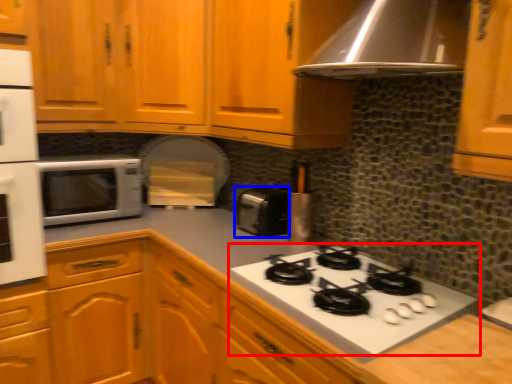
Question: Which object is further to the camera taking this photo, gas stove (highlighted by a red box) or toaster (highlighted by a blue box)?

Choices:
 (A) gas stove
 (B) toaster

Answer: (B)